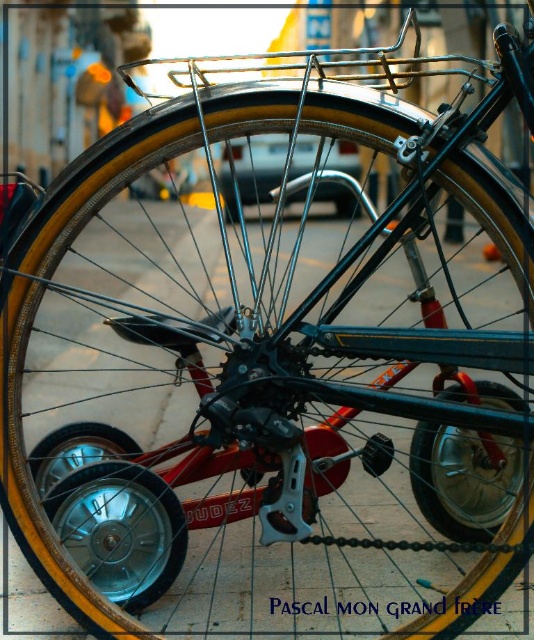
Looking at this image, you are a delivery person who needs to attach a package to the bicycle. The package is 10 cm tall. You have two options to place it either on the shiny metallic wheel at lower left or on the shiny metallic tire at center. Which location would allow the package to be placed without touching the ground?

The shiny metallic tire at center is taller than the shiny metallic wheel at lower left. Therefore, placing the package on the shiny metallic tire at center would be higher and prevent it from touching the ground.

You are a delivery person who needs to attach a small package to the bicycle. The package requires a minimum of 24 inches of space between the shiny metallic wheel at lower left and the shiny metallic tire at center to be placed safely. Based on the image, can you determine if there is enough space?

The distance between the shiny metallic wheel at lower left and the shiny metallic tire at center is 20.52 inches, which is less than the required 24 inches. Therefore, there is not enough space to safely place the package.